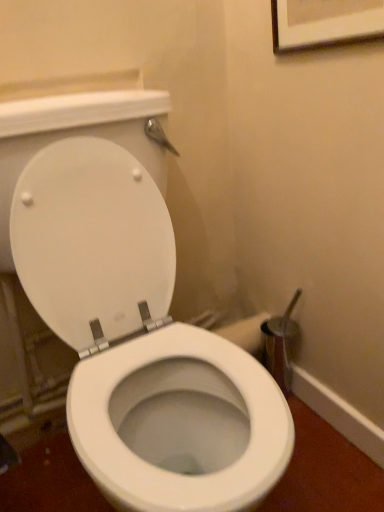
Question: Considering the relative sizes of white glossy toilet at center and wooden framed picture at upper center in the image provided, is white glossy toilet at center shorter than wooden framed picture at upper center?

Choices:
 (A) yes
 (B) no

Answer: (B)

Question: Is white glossy toilet at center further to camera compared to wooden framed picture at upper center?

Choices:
 (A) no
 (B) yes

Answer: (A)

Question: Is white glossy toilet at center not near wooden framed picture at upper center?

Choices:
 (A) no
 (B) yes

Answer: (A)

Question: Is white glossy toilet at center closer to camera compared to wooden framed picture at upper center?

Choices:
 (A) yes
 (B) no

Answer: (A)

Question: From a real-world perspective, is white glossy toilet at center beneath wooden framed picture at upper center?

Choices:
 (A) no
 (B) yes

Answer: (B)

Question: From the image's perspective, is white glossy toilet at center over wooden framed picture at upper center?

Choices:
 (A) no
 (B) yes

Answer: (A)

Question: Does wooden framed picture at upper center have a larger size compared to white glossy toilet at center?

Choices:
 (A) yes
 (B) no

Answer: (B)

Question: Does wooden framed picture at upper center have a lesser width compared to white glossy toilet at center?

Choices:
 (A) no
 (B) yes

Answer: (B)

Question: Does wooden framed picture at upper center have a greater height compared to white glossy toilet at center?

Choices:
 (A) yes
 (B) no

Answer: (B)

Question: Is wooden framed picture at upper center touching white glossy toilet at center?

Choices:
 (A) no
 (B) yes

Answer: (A)

Question: Considering the relative positions of wooden framed picture at upper center and white glossy toilet at center in the image provided, is wooden framed picture at upper center to the right of white glossy toilet at center from the viewer's perspective?

Choices:
 (A) no
 (B) yes

Answer: (B)

Question: Is wooden framed picture at upper center to the left of white glossy toilet at center from the viewer's perspective?

Choices:
 (A) no
 (B) yes

Answer: (A)

Question: Considering the positions of white glossy toilet at center and wooden framed picture at upper center in the image, is white glossy toilet at center taller or shorter than wooden framed picture at upper center?

Choices:
 (A) short
 (B) tall

Answer: (B)